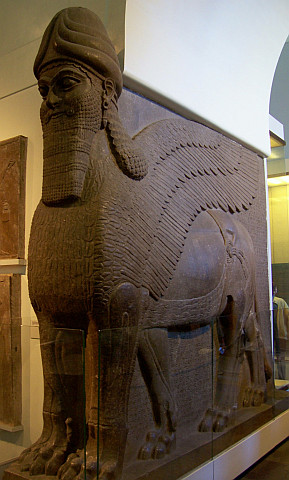
The width and height of the screenshot is (289, 480). I want to click on carved feet, so click(x=257, y=395), click(x=212, y=414), click(x=164, y=436), click(x=86, y=461), click(x=48, y=458).